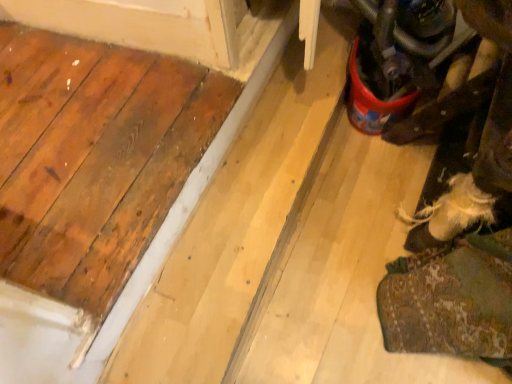
At what (x,y) coordinates should I click in order to perform the action: click on light wood plank at center. Please return your answer as a coordinate pair (x, y). Looking at the image, I should click on (238, 223).

This screenshot has height=384, width=512. Describe the element at coordinates (238, 223) in the screenshot. I see `light wood plank at center` at that location.

The width and height of the screenshot is (512, 384). I want to click on light wood plank at center, so click(238, 223).